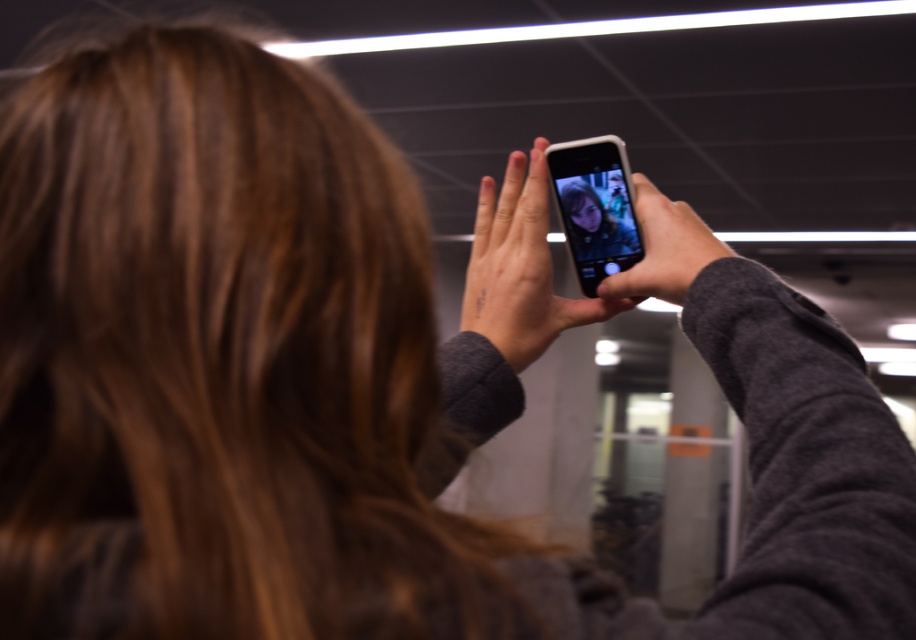
Does satin black phone at upper center appear over matte black phone at upper center?

Indeed, satin black phone at upper center is positioned over matte black phone at upper center.

Does satin black phone at upper center lie in front of matte black phone at upper center?

No, satin black phone at upper center is behind matte black phone at upper center.

Between point (544, 340) and point (663, 282), which one is positioned in front?

Positioned in front is point (663, 282).

Where is `satin black phone at upper center`? The height and width of the screenshot is (640, 916). satin black phone at upper center is located at coordinates (519, 268).